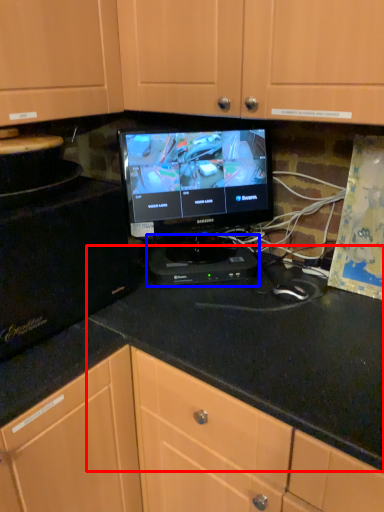
Question: Which of the following is the farthest to the observer, counter top (highlighted by a red box) or appliance (highlighted by a blue box)?

Choices:
 (A) counter top
 (B) appliance

Answer: (B)